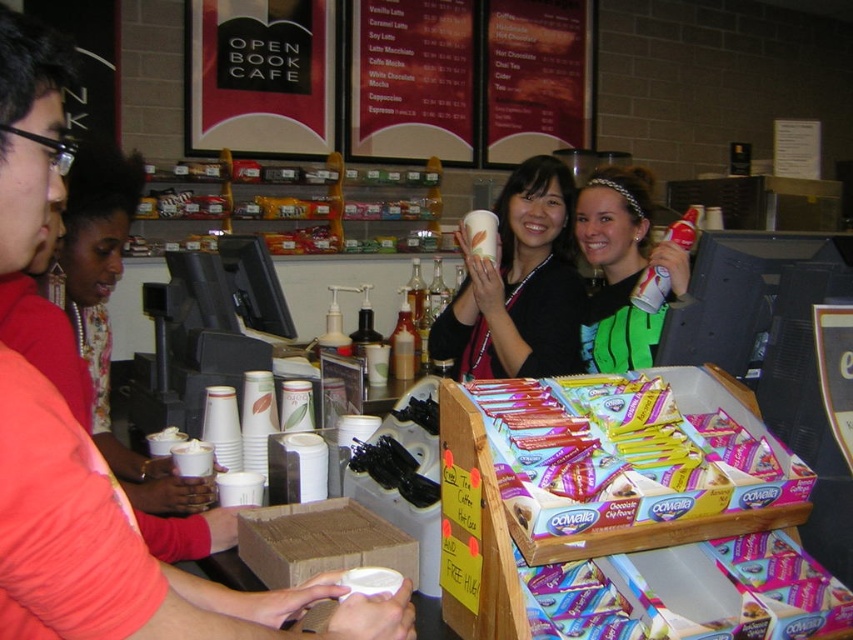
Question: Which point appears farthest from the camera in this image?

Choices:
 (A) pos(611,205)
 (B) pos(521,202)

Answer: (B)

Question: Is matte white cup at center above green fabric shirt at center?

Choices:
 (A) no
 (B) yes

Answer: (B)

Question: Which point is farther to the camera?

Choices:
 (A) pyautogui.click(x=647, y=212)
 (B) pyautogui.click(x=572, y=337)

Answer: (A)

Question: Is the position of matte white cup at center more distant than that of green fabric shirt at center?

Choices:
 (A) yes
 (B) no

Answer: (A)

Question: Does matte white cup at center appear over green fabric shirt at center?

Choices:
 (A) no
 (B) yes

Answer: (B)